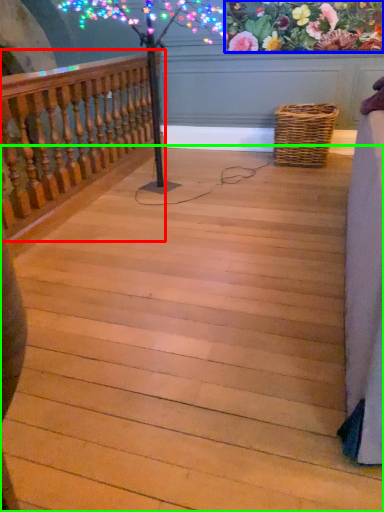
Question: Based on their relative distances, which object is farther from rail (highlighted by a red box)? Choose from floral arrangement (highlighted by a blue box) and stairs (highlighted by a green box).

Choices:
 (A) floral arrangement
 (B) stairs

Answer: (A)